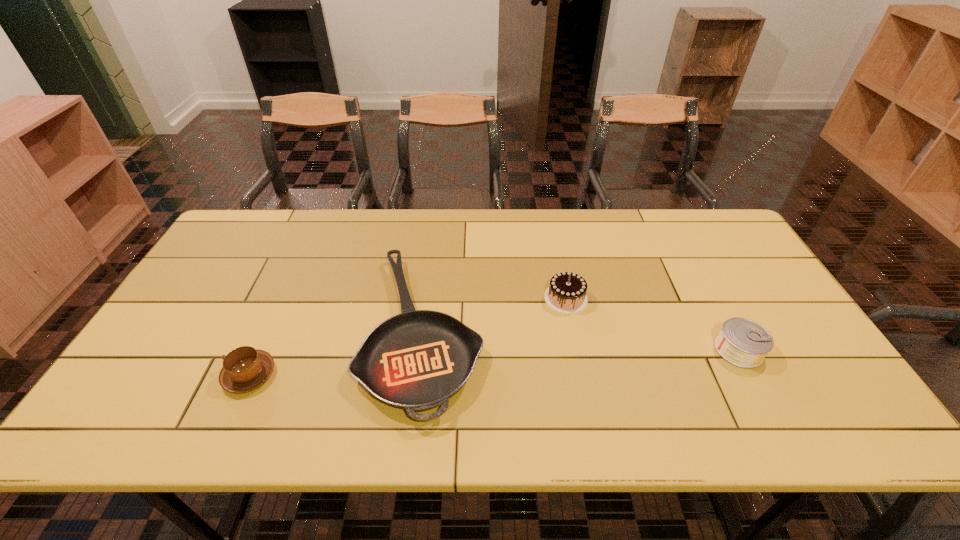
Identify the location of chocolate cake. (566, 294).

Where is `the second object from right to left`? This screenshot has width=960, height=540. the second object from right to left is located at coordinates (566, 294).

Find the location of `cappuccino`. cappuccino is located at coordinates (245, 368).

Identify the location of the rightmost object. (742, 342).

Locate an element on the screen. The image size is (960, 540). frying pan is located at coordinates (417, 360).

Locate an element on the screen. The height and width of the screenshot is (540, 960). the third object from right to left is located at coordinates (417, 360).

The height and width of the screenshot is (540, 960). In order to click on vacant space located 0.190m on the right of the tallest object in this screenshot , I will do 655,299.

Where is `vacant point located on the side of the leftmost object with the handle`? The image size is (960, 540). vacant point located on the side of the leftmost object with the handle is located at coordinates (191, 375).

Find the location of a particular element. This screenshot has width=960, height=540. free space located on the side of the leftmost object with the handle is located at coordinates (140, 375).

At what (x,y) coordinates should I click in order to perform the action: click on vacant space situated on the side of the leftmost object with the handle. Please return your answer as a coordinate pair (x, y). This screenshot has width=960, height=540. Looking at the image, I should click on (140, 375).